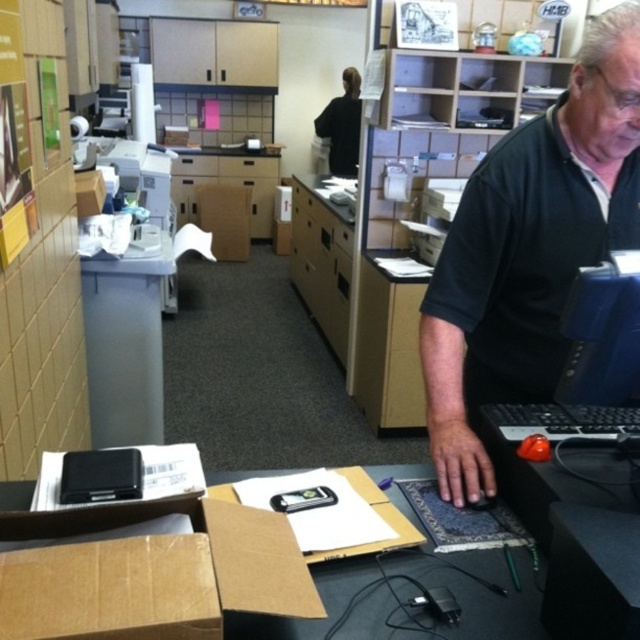
You are an office worker who needs to place a new 15 cm tall box on the desk. The box must be placed either on the black glossy monitor at upper right or the wooden file cabinet at center. Based on their heights, which object can safely accommodate the box without it exceeding the object?

The wooden file cabinet at center is taller than the black glossy monitor at upper right, so placing the 15 cm tall box on the wooden file cabinet at center would be safer as it won not exceed the cabinet height.

You need to place a new laptop on the desk without moving the brown cardboard box at lower left. Is there enough space on the desk to place the black plastic laptop at right next to the box?

The brown cardboard box at lower left is positioned under the black plastic laptop at right, so there is space to place the black plastic laptop at right next to the box without moving it.

You are a delivery person who just arrived at the office. You need to place a new laptop on the desk, which is 12 inches wide. The current desk has a brown cardboard box at lower left and a black plastic laptop at right. Can the new laptop fit between them without moving any existing items?

The distance between the brown cardboard box at lower left and the black plastic laptop at right is 23.57 inches. Since the new laptop is only 12 inches wide, there is enough space between them to place it without moving existing items.